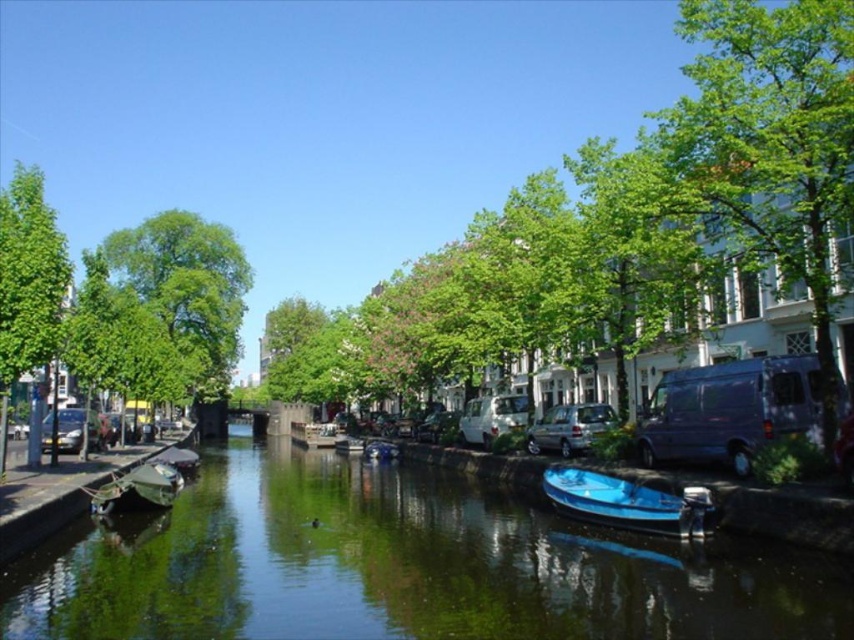
You are a tourist standing on the left bank of the canal. You want to take a photo of both the green leafy tree at center and the green matte boat at center in the same frame. Given that your camera has a maximum focal length that allows capturing objects up to 100 feet apart in the same shot, will you be able to include both in your photo?

The green leafy tree at center and green matte boat at center are 116.06 feet apart from each other, which exceeds the camera maximum focal length of 100 feet. Therefore, you cannot capture both in the same frame.

From the picture: You are standing on the left side of the canal and want to take a photo of the green leafy tree at center and the green reflective water at center. Which object should you frame first in your camera viewfinder to ensure both are in the shot?

You should frame the green leafy tree at center first because the green reflective water at center is to the left of it, so positioning the tree first ensures the water will be included to its left in the frame.

You are standing on the left bank of the canal and want to take a photo of the green matte boat at center without the green leafy tree at left blocking the view. Which direction should you move to get a clear shot?

You should move to the right side of the canal to avoid the green leafy tree at left blocking the view of the green matte boat at center, since the tree is in front of the boat from the current position.